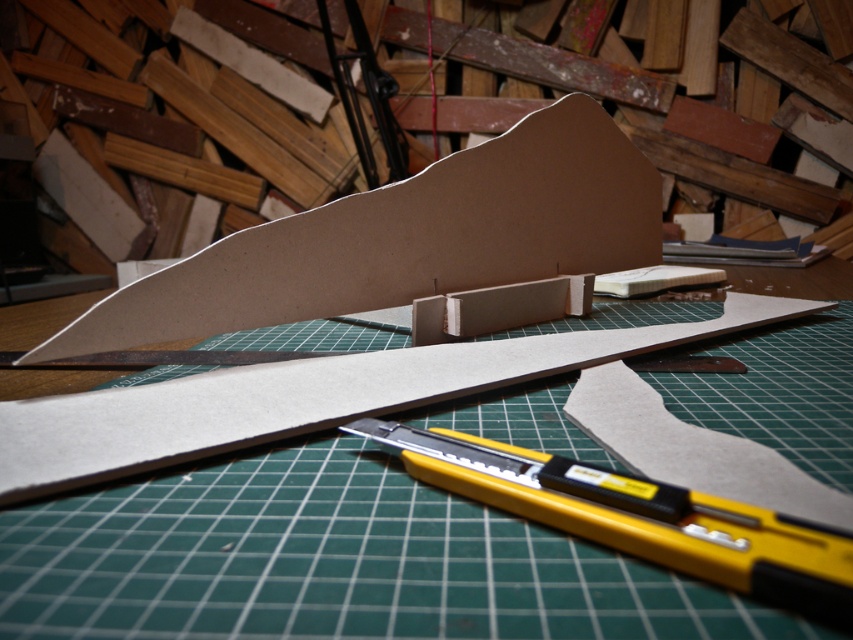
Question: Is brown cardboard at center smaller than yellow plastic utility knife at center?

Choices:
 (A) no
 (B) yes

Answer: (A)

Question: Does green cutting mat at center appear on the right side of brown cardboard at center?

Choices:
 (A) no
 (B) yes

Answer: (B)

Question: Which point is closer to the camera taking this photo?

Choices:
 (A) (402, 454)
 (B) (680, 579)
 (C) (450, 193)

Answer: (B)

Question: Is green cutting mat at center wider than yellow plastic utility knife at center?

Choices:
 (A) no
 (B) yes

Answer: (B)

Question: Which is farther from the green cutting mat at center?

Choices:
 (A) brown cardboard at center
 (B) yellow plastic utility knife at center

Answer: (A)

Question: Which is nearer to the yellow plastic utility knife at center?

Choices:
 (A) brown cardboard at center
 (B) green cutting mat at center

Answer: (B)